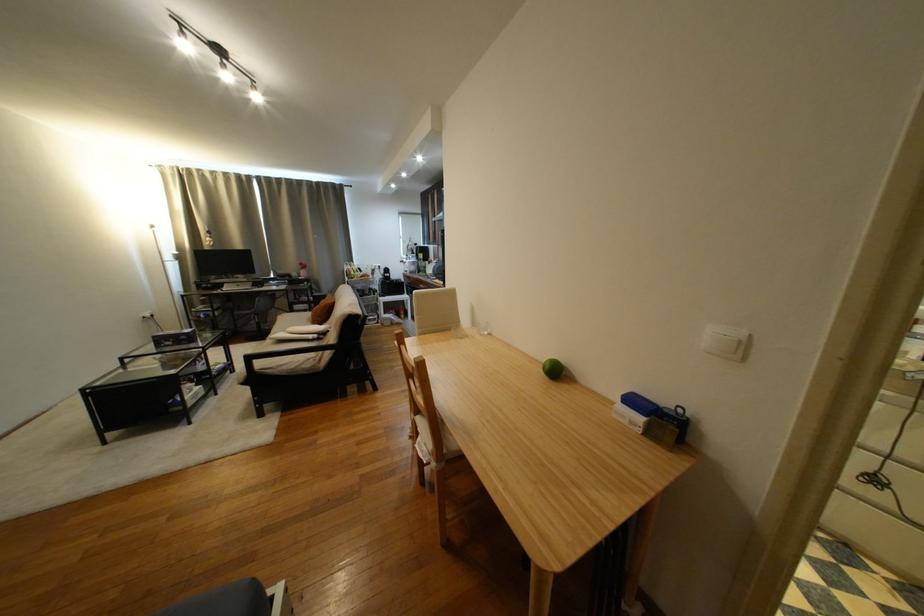
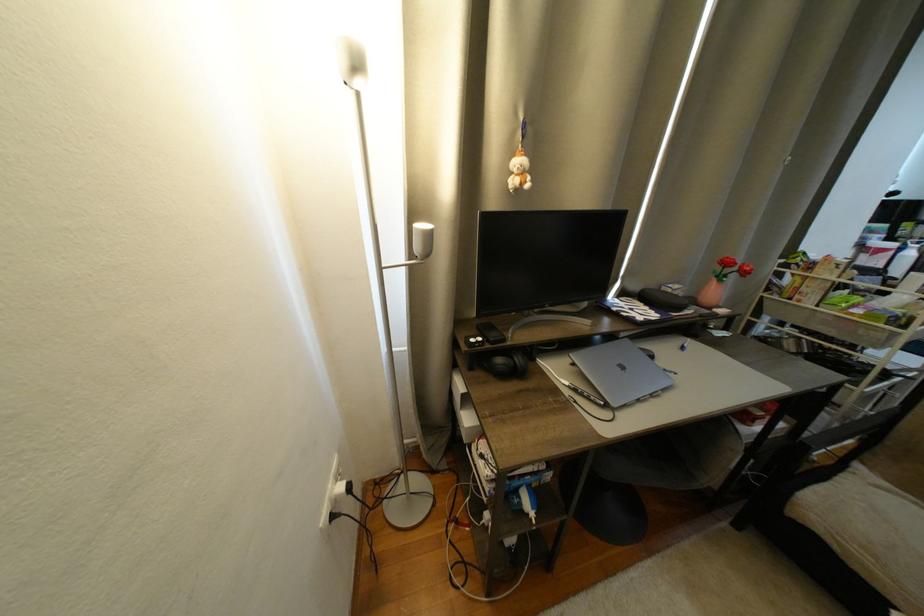
Locate, in the second image, the point that corresponds to (161,317) in the first image.

(358, 490)